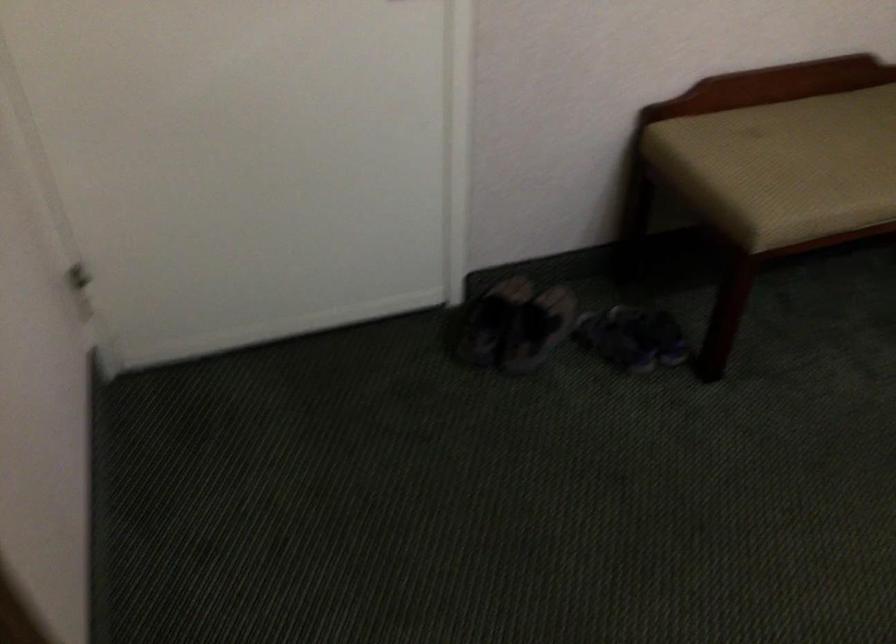
Where would you sit the bench sitting surface? Please return your answer as a coordinate pair (x, y).

(780, 174)